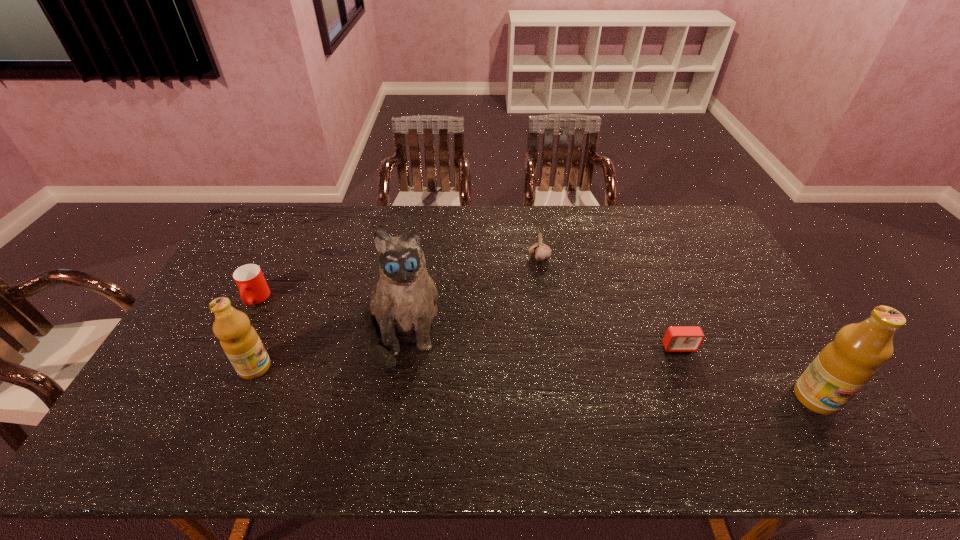
Identify the location of the shorter olive oil. (239, 340).

You are a GUI agent. You are given a task and a screenshot of the screen. Output one action in this format:
    pyautogui.click(x=<x>, y=<y>)
    Task: Click on the third tallest object
    
    Given the screenshot: What is the action you would take?
    pyautogui.click(x=239, y=340)

The image size is (960, 540). What are the coordinates of `the right olive oil` in the screenshot? It's located at (844, 366).

Find the location of a particular element. The height and width of the screenshot is (540, 960). the taller olive oil is located at coordinates (844, 366).

I want to click on the farthest object, so click(x=540, y=251).

You are a GUI agent. You are given a task and a screenshot of the screen. Output one action in this format:
    pyautogui.click(x=<x>, y=<y>)
    Task: Click on the garlic
    Image resolution: width=960 pixels, height=540 pixels.
    Given the screenshot: What is the action you would take?
    pyautogui.click(x=540, y=251)

Identify the location of the shortest object. (677, 338).

Identify the location of the second object from right to left. (677, 338).

The width and height of the screenshot is (960, 540). I want to click on cat, so click(x=403, y=302).

This screenshot has height=540, width=960. I want to click on cup, so point(253,288).